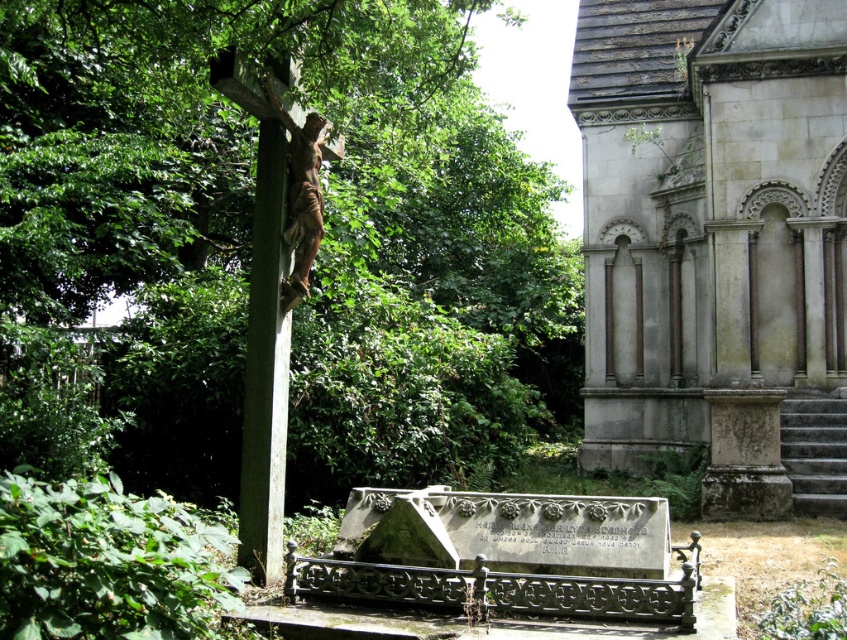
Question: Which point appears closest to the camera in this image?

Choices:
 (A) (757, 413)
 (B) (296, 212)
 (C) (283, 90)

Answer: (C)

Question: Can you confirm if green stone cross at left is positioned below bronze statue at center?

Choices:
 (A) yes
 (B) no

Answer: (A)

Question: Which object appears closest to the camera in this image?

Choices:
 (A) green leafy tree at left
 (B) bronze statue at center

Answer: (A)

Question: In this image, where is green stone cross at left located relative to bronze statue at center?

Choices:
 (A) above
 (B) below

Answer: (B)

Question: In this image, where is gray stone church at right located relative to bronze statue at center?

Choices:
 (A) left
 (B) right

Answer: (B)

Question: Which object appears closest to the camera in this image?

Choices:
 (A) green stone cross at left
 (B) gray stone church at right

Answer: (A)